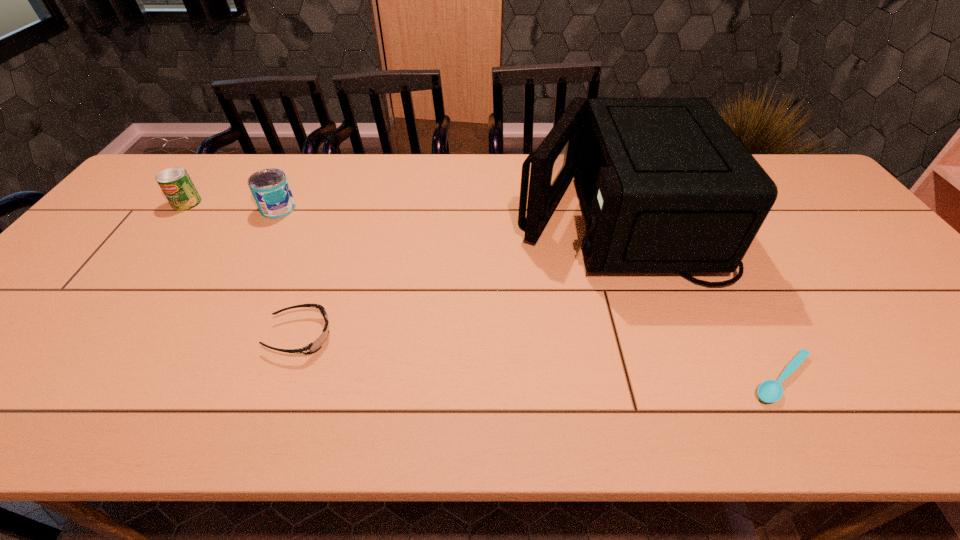
In the image, there is a desktop. Identify the location of vacant space at the left edge. click(x=150, y=205).

In the image, there is a desktop. Where is `blank space at the right edge`? blank space at the right edge is located at coordinates coord(833,242).

In the image, there is a desktop. In order to click on vacant region at the far left corner in this screenshot , I will do `click(182, 158)`.

At what (x,y) coordinates should I click in order to perform the action: click on free space at the far right corner of the desktop. Please return your answer as a coordinate pair (x, y). This screenshot has width=960, height=540. Looking at the image, I should click on (768, 163).

Where is `empty space between the microwave oven and the leftmost object`? The image size is (960, 540). empty space between the microwave oven and the leftmost object is located at coordinates (401, 209).

The image size is (960, 540). I want to click on vacant space that's between the tallest object and the right can, so click(x=446, y=212).

At what (x,y) coordinates should I click in order to perform the action: click on free area in between the tallest object and the left can. Please return your answer as a coordinate pair (x, y). Looking at the image, I should click on click(401, 209).

Locate an element on the screen. free space between the left can and the second object from left to right is located at coordinates (232, 206).

Locate an element on the screen. unoccupied area between the spoon and the right can is located at coordinates (530, 293).

Identify the location of free space between the spoon and the leftmost object. This screenshot has height=540, width=960. (485, 291).